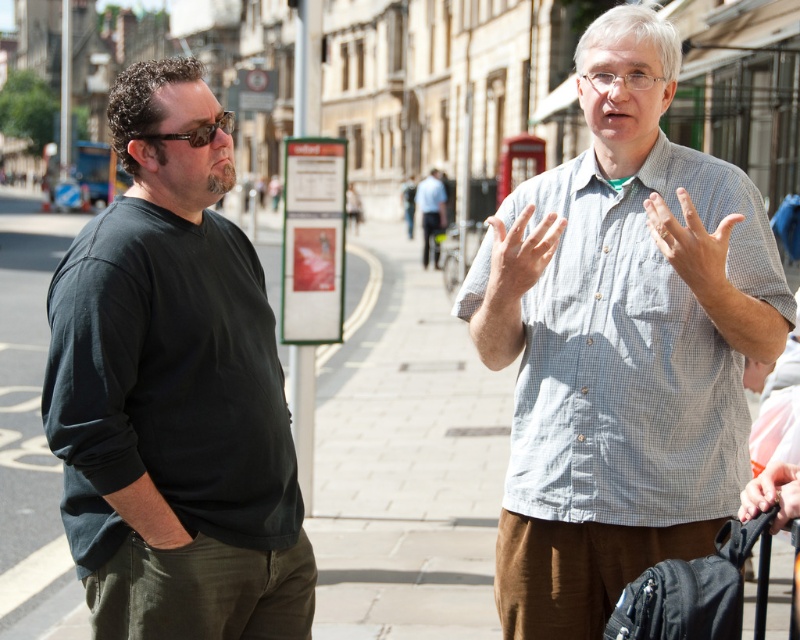
Question: Considering the relative positions of light blue checkered shirt at center and smooth skin hand at lower right in the image provided, where is light blue checkered shirt at center located with respect to smooth skin hand at lower right?

Choices:
 (A) right
 (B) left

Answer: (B)

Question: Considering the relative positions of black matte shirt at left and light blue shirt at center in the image provided, where is black matte shirt at left located with respect to light blue shirt at center?

Choices:
 (A) right
 (B) left

Answer: (B)

Question: Which is nearer to the paved stone sidewalk at center?

Choices:
 (A) smooth skin hand at lower right
 (B) light blue shirt at center
 (C) white matte hand at center

Answer: (B)

Question: Among these objects, which one is nearest to the camera?

Choices:
 (A) white matte hand at center
 (B) white textured shirt at center

Answer: (B)

Question: Estimate the real-world distances between objects in this image. Which object is farther from the smooth skin hand at lower right?

Choices:
 (A) black matte shirt at left
 (B) light blue checkered shirt at center

Answer: (A)

Question: Considering the relative positions of light blue checkered shirt at center and black matte shirt at left in the image provided, where is light blue checkered shirt at center located with respect to black matte shirt at left?

Choices:
 (A) right
 (B) left

Answer: (A)